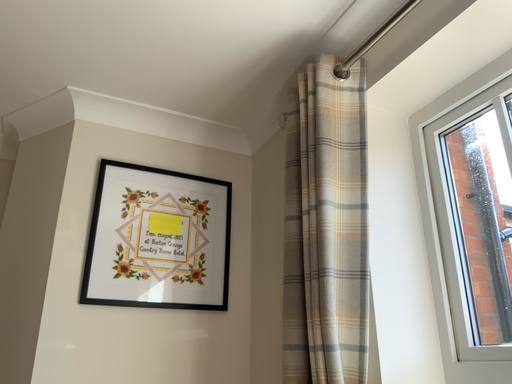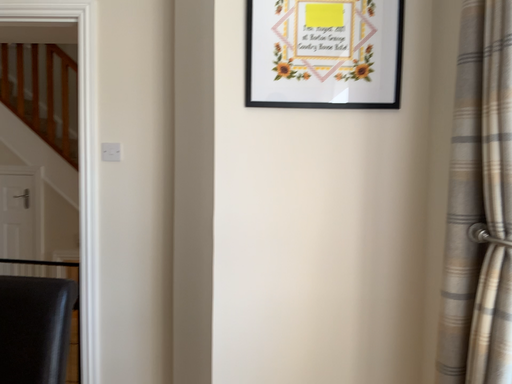
Question: Which way did the camera rotate in the video?

Choices:
 (A) rotated right
 (B) rotated left

Answer: (B)